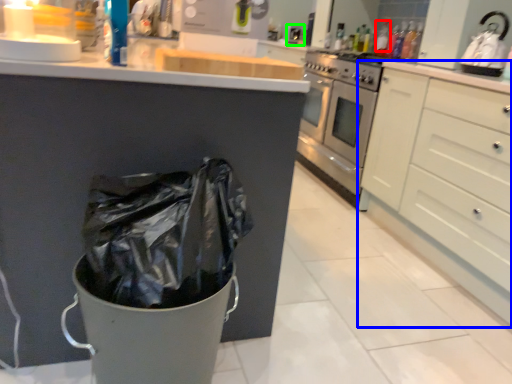
Question: Based on their relative distances, which object is farther from bottle (highlighted by a red box)? Choose from cabinetry (highlighted by a blue box) and sink (highlighted by a green box).

Choices:
 (A) cabinetry
 (B) sink

Answer: (A)